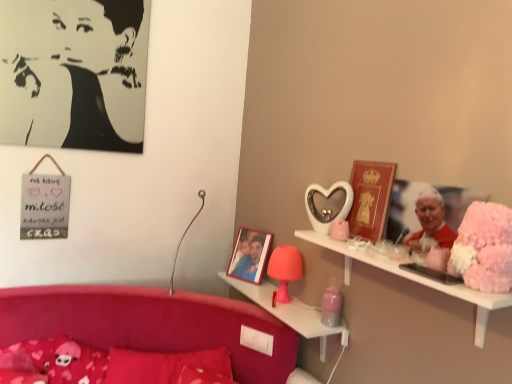
Locate an element on the screen. This screenshot has width=512, height=384. free point above matte pink lamp at center, arranged as the second shelf when viewed from the top (from a real-world perspective) is located at coordinates (276, 301).